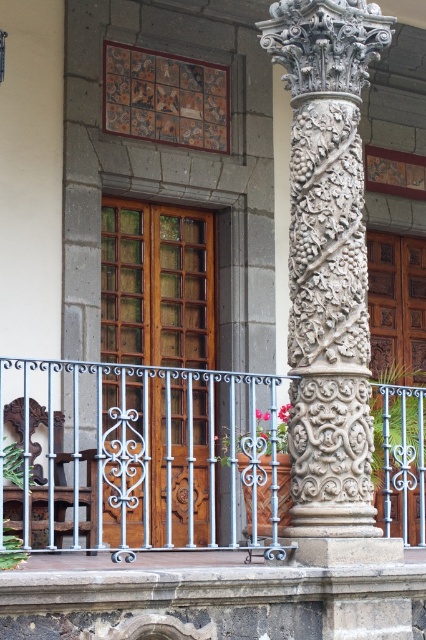
Which is more to the right, white wrought iron balustrade at center or white stone column at center?

white stone column at center

Who is higher up, white wrought iron balustrade at center or white stone column at center?

white stone column at center is above.

Is point (403, 451) in front of point (322, 532)?

That is False.

What are the coordinates of `white wrought iron balustrade at center` in the screenshot? It's located at (143, 456).